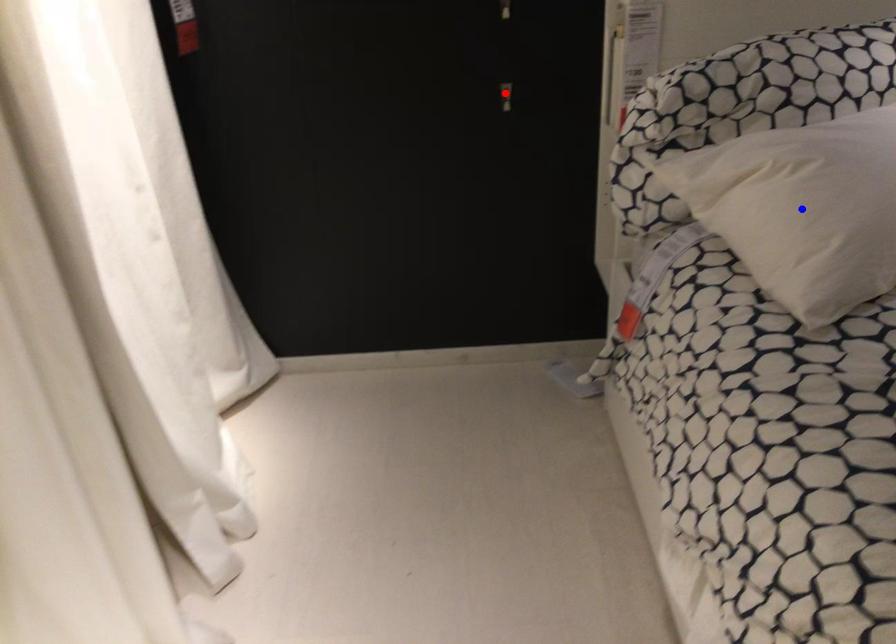
Question: Two points are marked on the image. Which point is closer to the camera?

Choices:
 (A) Blue point is closer.
 (B) Red point is closer.

Answer: (A)